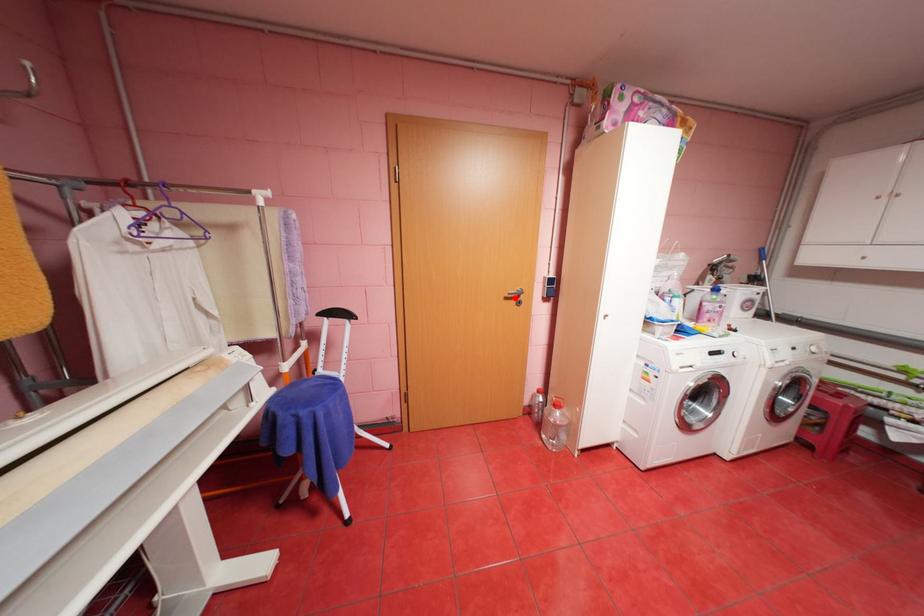
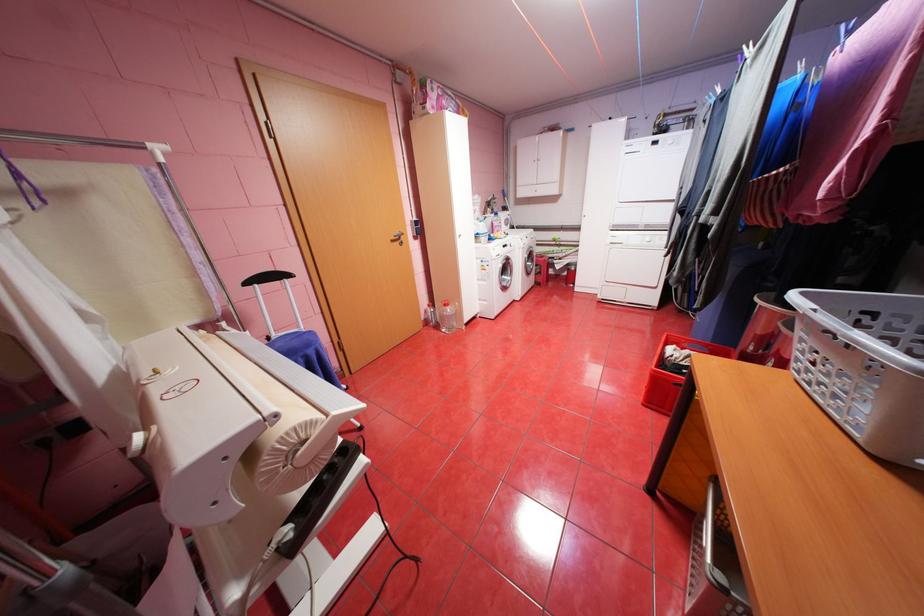
Where in the second image is the point corresponding to the highlighted location from the first image?

(400, 241)